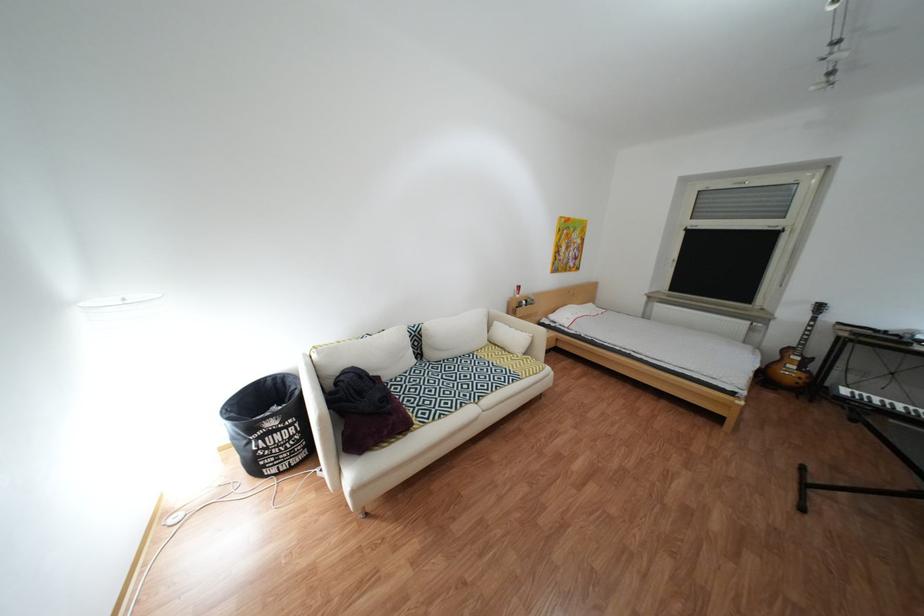
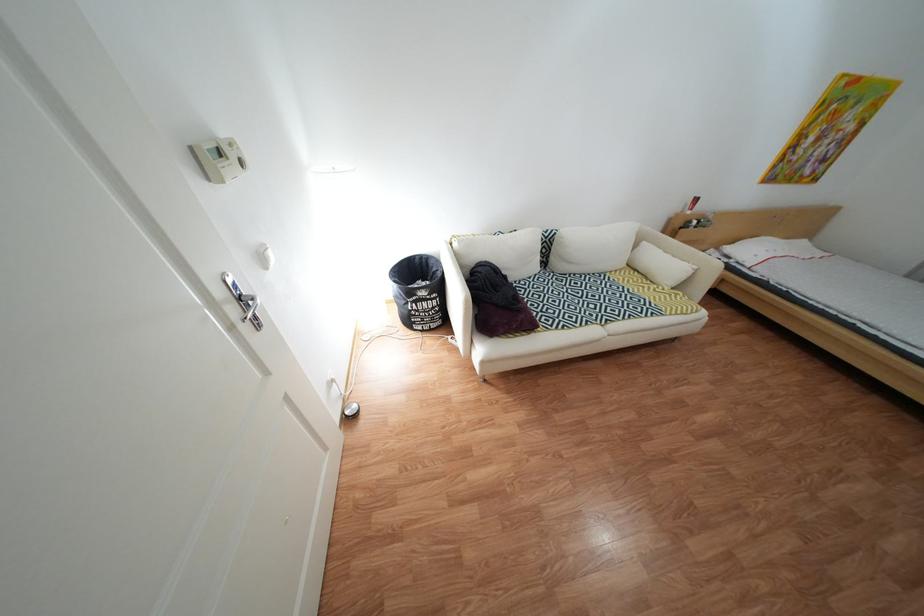
The point at (283, 448) is marked in the first image. Where is the corresponding point in the second image?

(433, 312)